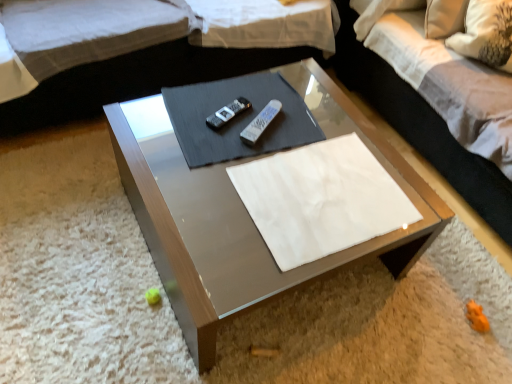
Where is `vacant space that is in between white plastic remote at center, acting as the 1th remote starting from the right, and black plastic remote at center, placed as the first remote when sorted from left to right`? The image size is (512, 384). vacant space that is in between white plastic remote at center, acting as the 1th remote starting from the right, and black plastic remote at center, placed as the first remote when sorted from left to right is located at coordinates (241, 121).